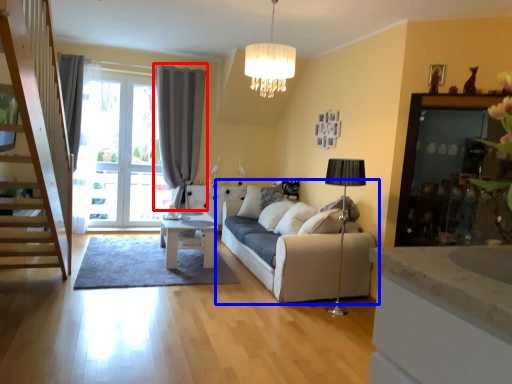
Question: Which object is further to the camera taking this photo, curtain (highlighted by a red box) or studio couch (highlighted by a blue box)?

Choices:
 (A) curtain
 (B) studio couch

Answer: (A)